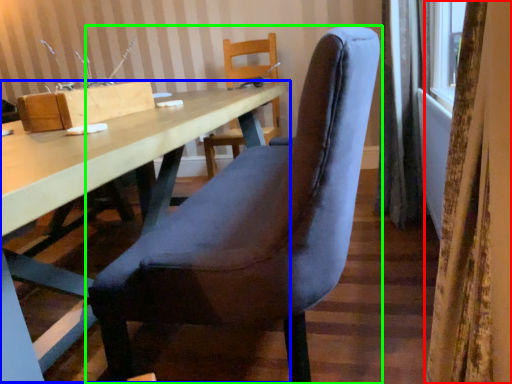
Question: Estimate the real-world distances between objects in this image. Which object is farther from curtain (highlighted by a red box), table (highlighted by a blue box) or chair (highlighted by a green box)?

Choices:
 (A) table
 (B) chair

Answer: (A)